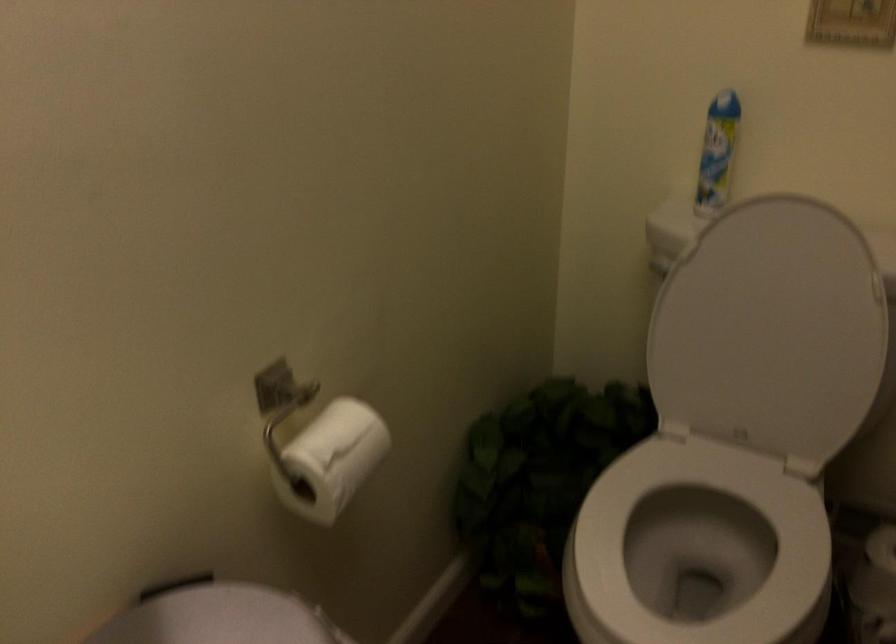
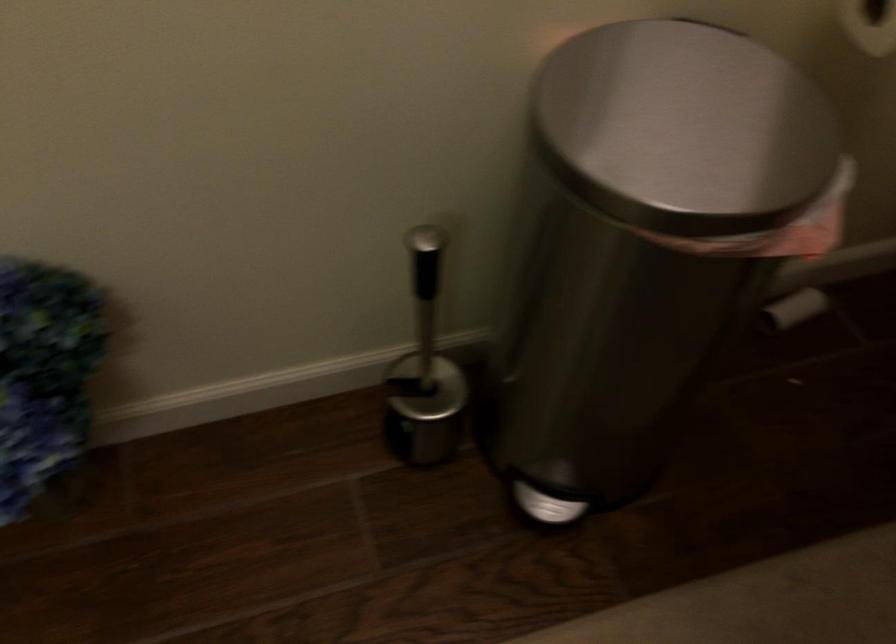
How did the camera likely rotate?

The camera's rotation is toward left-down.